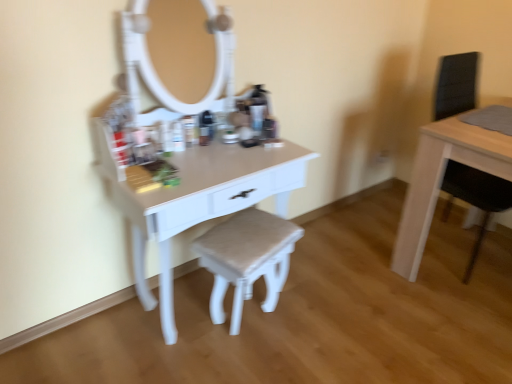
Locate an element on the screen. The image size is (512, 384). vacant area that lies between matte white stool at center and white glossy table at center, marked as the 1th table in a left-to-right arrangement is located at coordinates [225, 348].